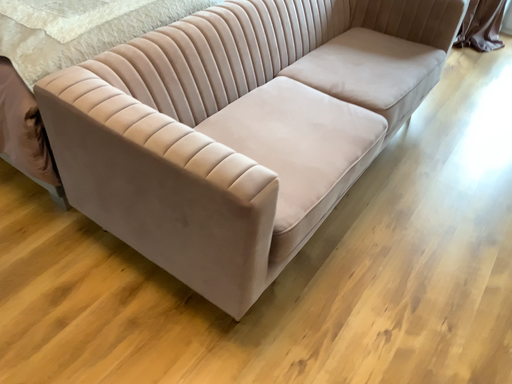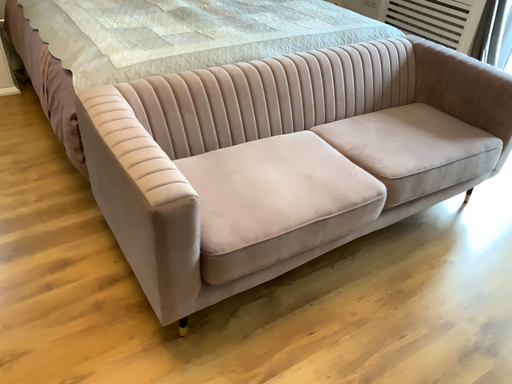
Question: How did the camera likely rotate when shooting the video?

Choices:
 (A) rotated downward
 (B) rotated upward

Answer: (B)